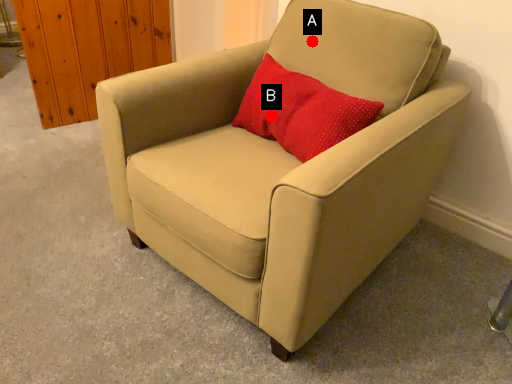
Question: Two points are circled on the image, labeled by A and B beside each circle. Among these points, which one is nearest to the camera?

Choices:
 (A) A is closer
 (B) B is closer

Answer: (B)